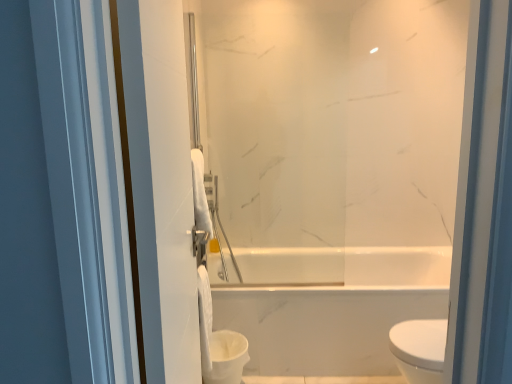
Question: Considering the relative sizes of white glossy towel at left and white plastic toilet bowl at lower left in the image provided, is white glossy towel at left wider than white plastic toilet bowl at lower left?

Choices:
 (A) yes
 (B) no

Answer: (B)

Question: Would you say white plastic toilet bowl at lower left is part of white glossy towel at left's contents?

Choices:
 (A) no
 (B) yes

Answer: (A)

Question: From a real-world perspective, is white glossy towel at left physically above white plastic toilet bowl at lower left?

Choices:
 (A) no
 (B) yes

Answer: (B)

Question: Is white glossy towel at left oriented towards white plastic toilet bowl at lower left?

Choices:
 (A) no
 (B) yes

Answer: (A)

Question: Does white glossy towel at left lie in front of white plastic toilet bowl at lower left?

Choices:
 (A) no
 (B) yes

Answer: (B)

Question: Is point (175, 248) positioned closer to the camera than point (201, 291)?

Choices:
 (A) closer
 (B) farther

Answer: (A)

Question: Looking at the image, does white glossy towel at left seem bigger or smaller compared to white matte toilet paper at center?

Choices:
 (A) big
 (B) small

Answer: (A)

Question: Visually, is white glossy towel at left positioned to the left or to the right of white matte toilet paper at center?

Choices:
 (A) right
 (B) left

Answer: (A)

Question: In the image, is white glossy towel at left positioned in front of or behind white matte toilet paper at center?

Choices:
 (A) front
 (B) behind

Answer: (A)

Question: From a real-world perspective, relative to white matte toilet paper at center, is white plastic toilet bowl at lower left vertically above or below?

Choices:
 (A) below
 (B) above

Answer: (A)

Question: Is white plastic toilet bowl at lower left to the left or to the right of white matte toilet paper at center in the image?

Choices:
 (A) left
 (B) right

Answer: (B)

Question: Is white plastic toilet bowl at lower left taller or shorter than white matte toilet paper at center?

Choices:
 (A) short
 (B) tall

Answer: (A)

Question: Is point (246, 360) positioned closer to the camera than point (202, 337)?

Choices:
 (A) closer
 (B) farther

Answer: (B)

Question: From their relative heights in the image, would you say white matte toilet paper at center is taller or shorter than white plastic toilet bowl at lower left?

Choices:
 (A) tall
 (B) short

Answer: (A)

Question: In terms of size, does white matte toilet paper at center appear bigger or smaller than white plastic toilet bowl at lower left?

Choices:
 (A) small
 (B) big

Answer: (A)